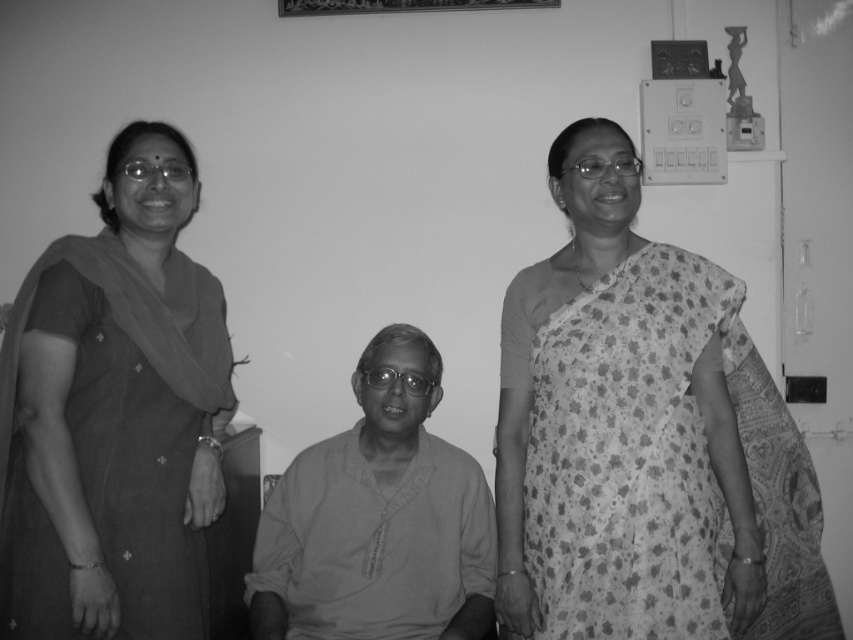
Is printed cotton saree at right bigger than matte black saree at left?

Correct, printed cotton saree at right is larger in size than matte black saree at left.

Is point (637, 468) less distant than point (177, 417)?

Yes.

At what (x,y) coordinates should I click in order to perform the action: click on printed cotton saree at right. Please return your answer as a coordinate pair (x, y). This screenshot has width=853, height=640. Looking at the image, I should click on (643, 436).

Does point (314, 611) come behind point (676, 67)?

No, it is in front of (676, 67).

Can you confirm if smooth cotton kurta at center is thinner than metallic picture frame at upper right?

No.

Where is `smooth cotton kurta at center`? smooth cotton kurta at center is located at coordinates (378, 518).

Is matte black saree at left bigger than metallic rectangular frame at upper center?

Correct, matte black saree at left is larger in size than metallic rectangular frame at upper center.

Which of these two, matte black saree at left or metallic rectangular frame at upper center, stands taller?

matte black saree at left

Describe the element at coordinates (114, 413) in the screenshot. The image size is (853, 640). I see `matte black saree at left` at that location.

I want to click on matte black saree at left, so (114, 413).